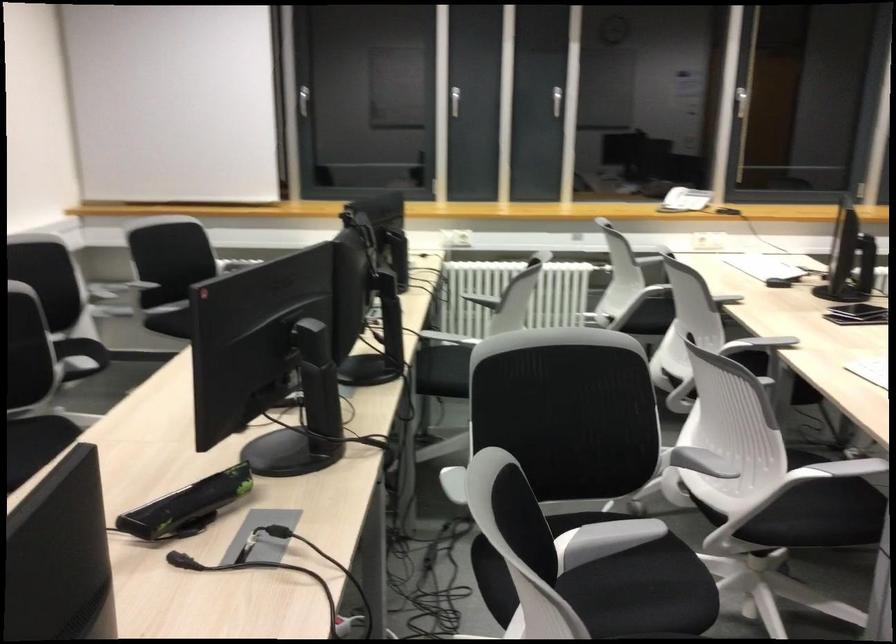
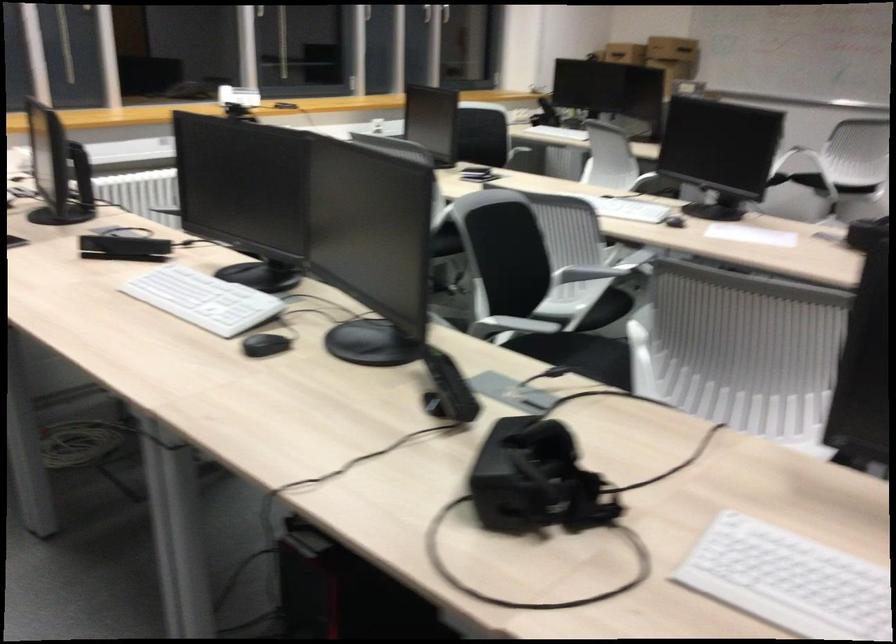
Find the pixel in the second image that matches point 535,515 in the first image.

(734, 277)